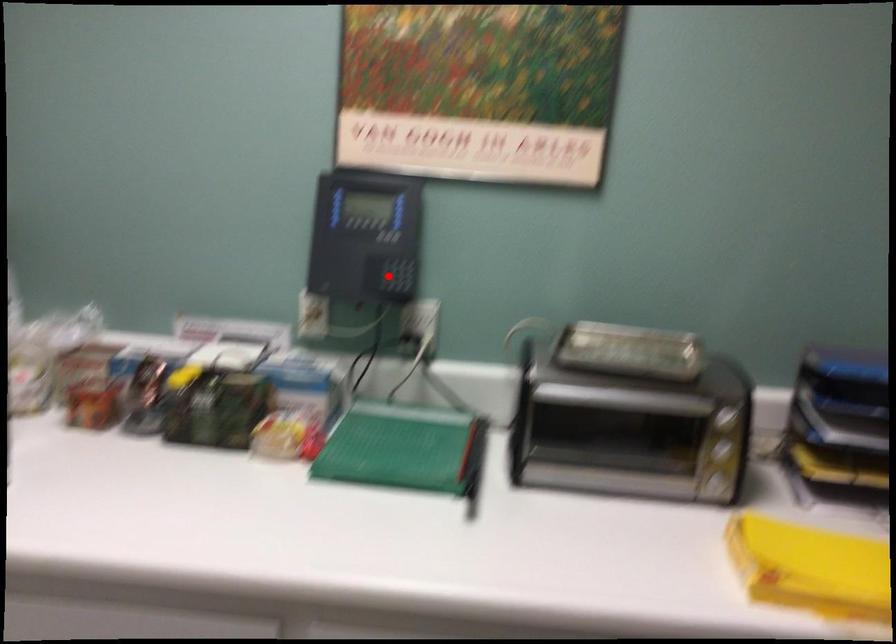
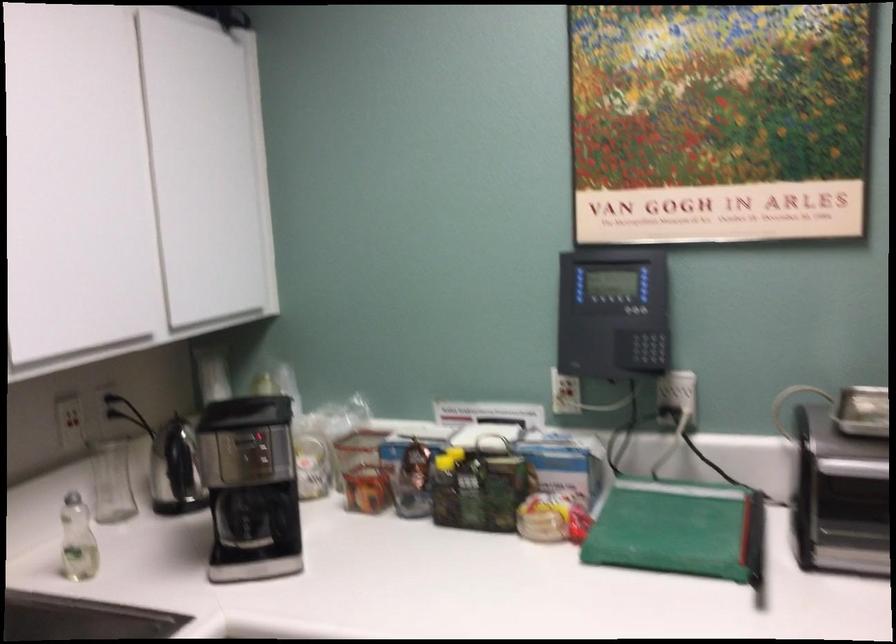
Where in the second image is the point corresponding to the highlighted location from the first image?

(642, 348)